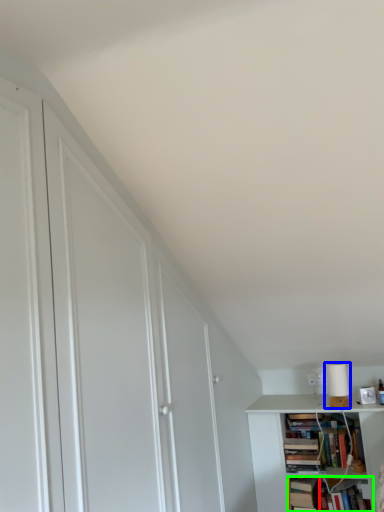
Question: Estimate the real-world distances between objects in this image. Which object is farther from book (highlighted by a red box), lamp (highlighted by a blue box) or book (highlighted by a green box)?

Choices:
 (A) lamp
 (B) book

Answer: (A)